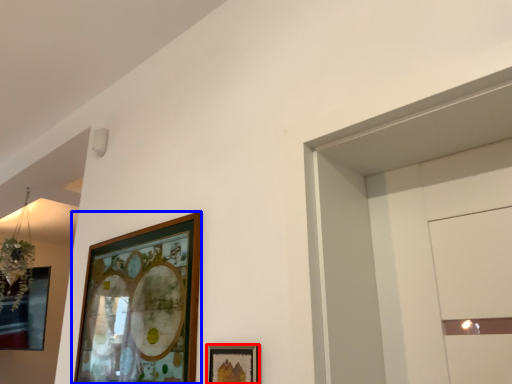
Question: Among these objects, which one is nearest to the camera, picture frame (highlighted by a red box) or picture frame (highlighted by a blue box)?

Choices:
 (A) picture frame
 (B) picture frame

Answer: (A)